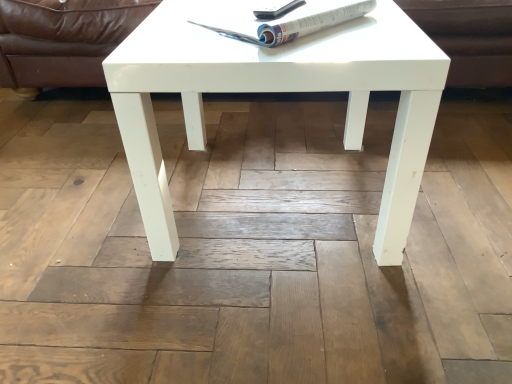
The width and height of the screenshot is (512, 384). In order to click on free spot in front of white glossy coffee table at center in this screenshot , I will do `click(273, 316)`.